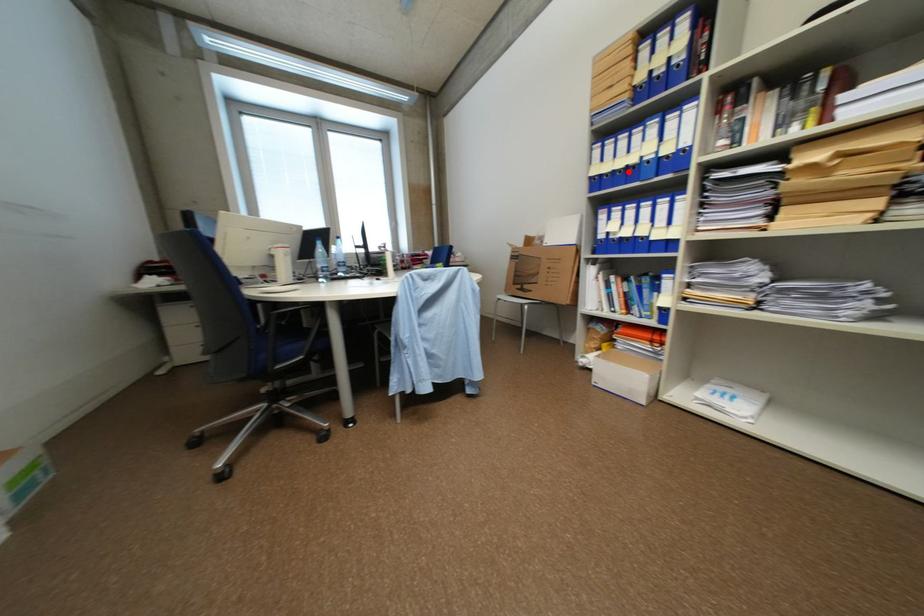
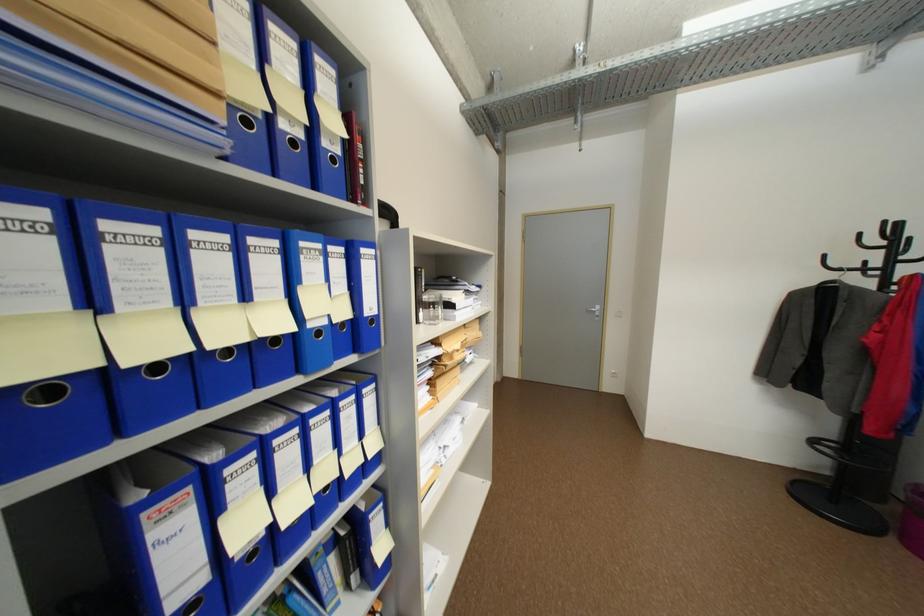
In the second image, find the point that corresponds to the highlighted location in the first image.

(236, 352)